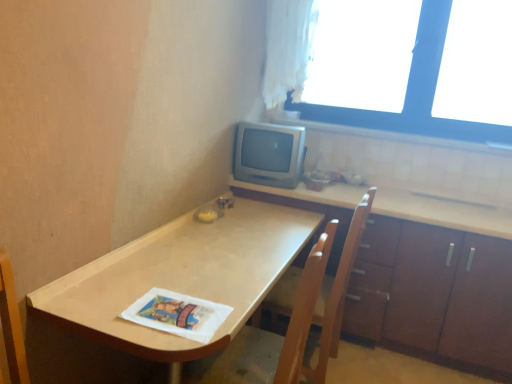
Where is `vacant region above white paper magazine at lower center (from a real-world perspective)`? The image size is (512, 384). vacant region above white paper magazine at lower center (from a real-world perspective) is located at coordinates (175, 310).